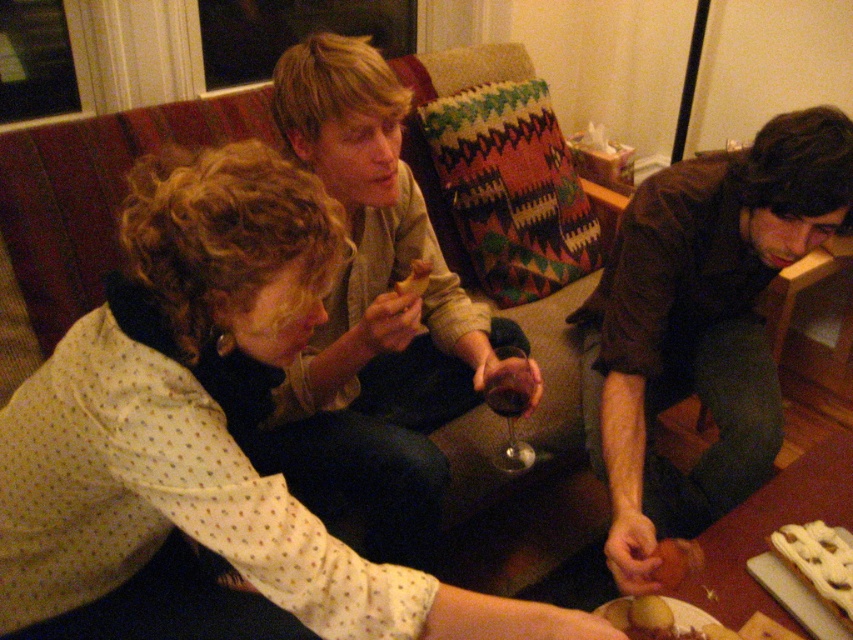
Question: Can you confirm if white dotted shirt at center is wider than golden brown bread at center?

Choices:
 (A) no
 (B) yes

Answer: (B)

Question: Which object appears closest to the camera in this image?

Choices:
 (A) yellow matte potato at lower center
 (B) smooth brown bread at lower center
 (C) matte beige sweater at center
 (D) white dotted shirt at center

Answer: (D)

Question: Based on their relative distances, which object is nearer to the smooth brown bread at lower center?

Choices:
 (A) golden brown bread at center
 (B) white glazed pastry at lower right
 (C) golden crispy potato at lower center
 (D) matte beige sweater at center

Answer: (C)

Question: From the image, what is the correct spatial relationship of white dotted shirt at center in relation to brown leather jacket at lower right?

Choices:
 (A) below
 (B) above

Answer: (A)

Question: Which of the following is the closest to the observer?

Choices:
 (A) (x=112, y=476)
 (B) (x=665, y=556)
 (C) (x=419, y=269)
 (D) (x=798, y=532)

Answer: (A)

Question: Can you confirm if matte beige sweater at center is bigger than smooth brown bread at lower center?

Choices:
 (A) yes
 (B) no

Answer: (A)